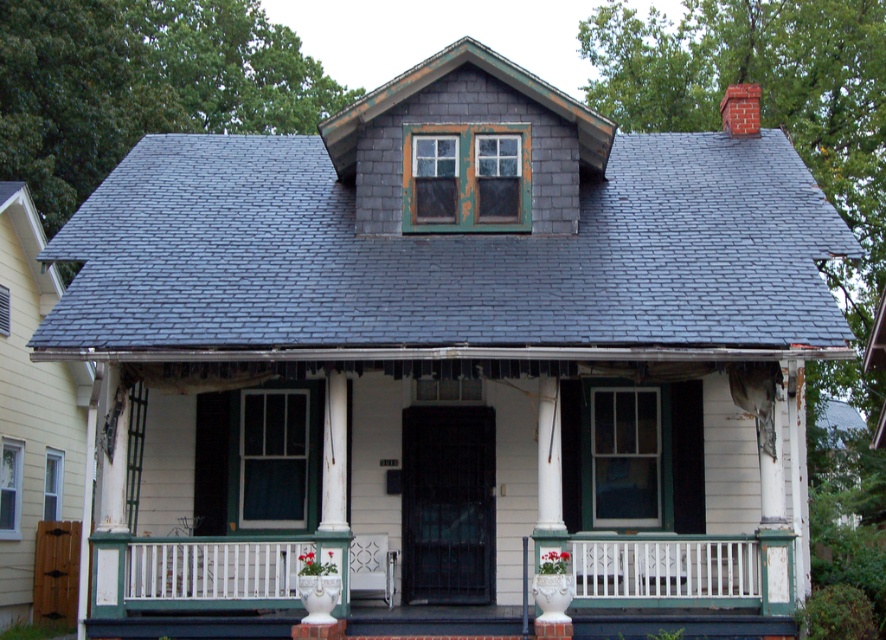
Question: Is white painted wood porch at center positioned at the back of white glossy column at center?

Choices:
 (A) yes
 (B) no

Answer: (A)

Question: Among these points, which one is nearest to the camera?

Choices:
 (A) (578, 628)
 (B) (542, 385)

Answer: (A)

Question: Can you confirm if white painted wood porch at center is positioned to the left of white glossy column at center?

Choices:
 (A) no
 (B) yes

Answer: (B)

Question: Which point is farther to the camera?

Choices:
 (A) white glossy column at center
 (B) white painted wood porch at center

Answer: (B)

Question: Observing the image, what is the correct spatial positioning of white painted wood porch at center in reference to white glossy column at center?

Choices:
 (A) left
 (B) right

Answer: (A)